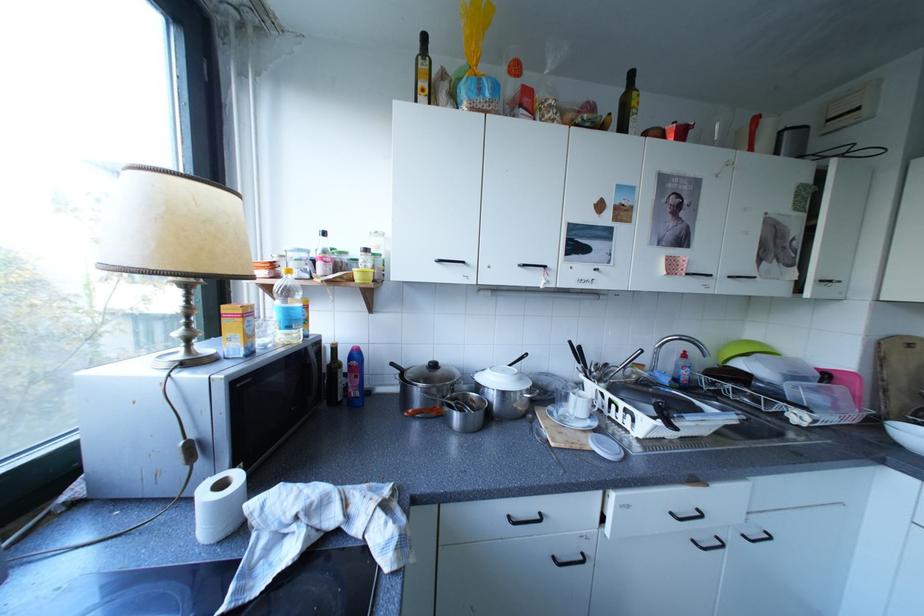
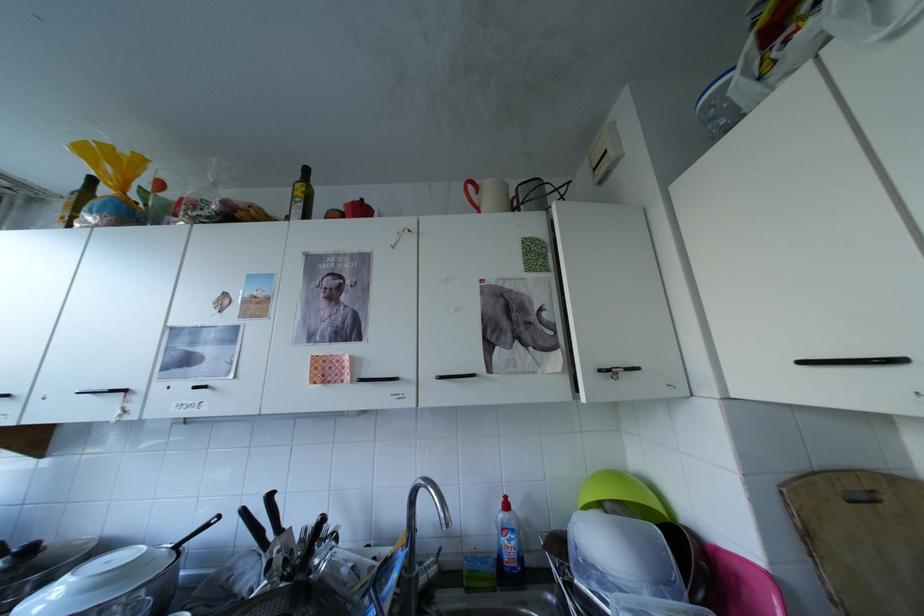
Where in the second image is the point corresponding to pixel 696 371 from the first image?

(517, 541)